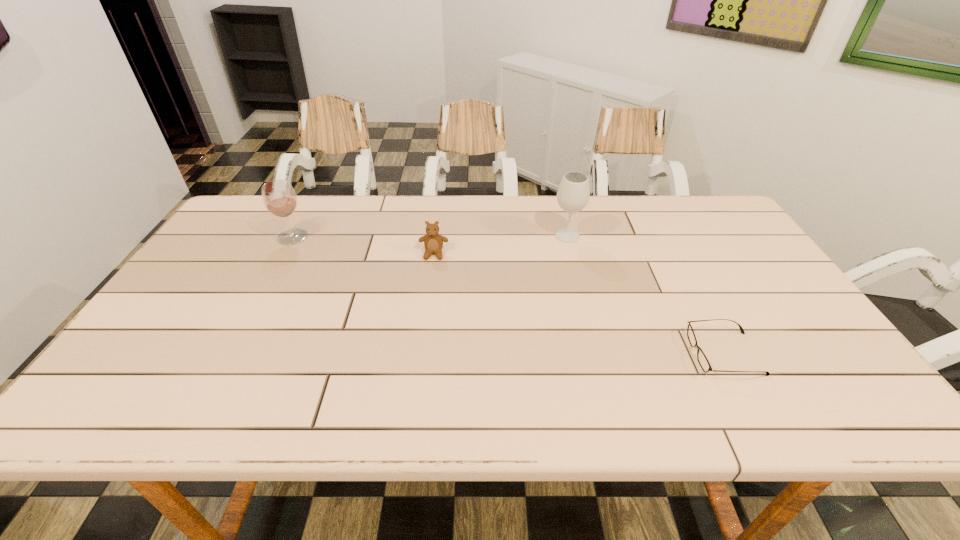
This screenshot has height=540, width=960. Find the location of `free space located on the front-facing side of the nearest object`. free space located on the front-facing side of the nearest object is located at coordinates (553, 354).

Image resolution: width=960 pixels, height=540 pixels. Find the location of `vacant space located on the front-facing side of the nearest object`. vacant space located on the front-facing side of the nearest object is located at coordinates coord(649,354).

Where is `vacant space at the near edge of the desktop`? The image size is (960, 540). vacant space at the near edge of the desktop is located at coordinates (632, 411).

In the image, there is a desktop. Where is `blank space at the left edge`? The width and height of the screenshot is (960, 540). blank space at the left edge is located at coordinates (188, 332).

Locate an element on the screen. The height and width of the screenshot is (540, 960). free region at the right edge is located at coordinates (759, 275).

Identify the location of vacant space at the far left corner of the desktop. (230, 229).

This screenshot has width=960, height=540. Find the location of `vacant region at the far right corner`. vacant region at the far right corner is located at coordinates (702, 219).

Find the location of a particular element. Image resolution: width=960 pixels, height=540 pixels. vacant area between the third object from right to left and the second object from right to left is located at coordinates (500, 245).

Identify the location of free spot between the shortest object and the right wineglass. This screenshot has width=960, height=540. (646, 295).

Where is `free area in between the third object from left to right and the third tallest object`? The width and height of the screenshot is (960, 540). free area in between the third object from left to right and the third tallest object is located at coordinates (500, 245).